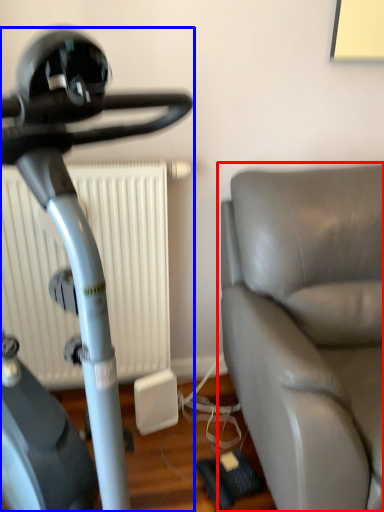
Question: Among these objects, which one is nearest to the camera, studio couch (highlighted by a red box) or stationary bicycle (highlighted by a blue box)?

Choices:
 (A) studio couch
 (B) stationary bicycle

Answer: (B)